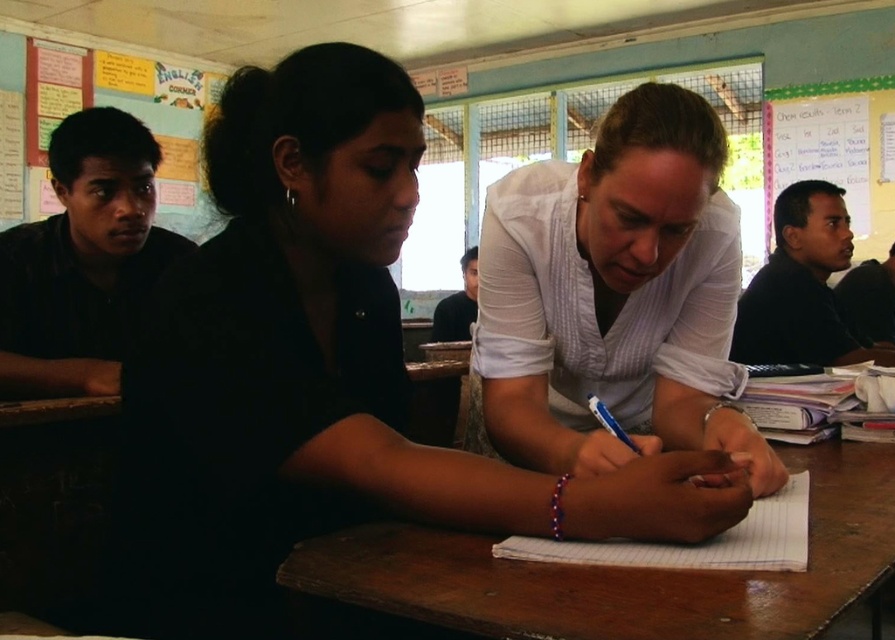
Question: Which point appears closest to the camera in this image?

Choices:
 (A) (827, 481)
 (B) (410, 211)
 (C) (806, 500)

Answer: (B)

Question: Is wooden table at center positioned before white paper at center?

Choices:
 (A) yes
 (B) no

Answer: (A)

Question: Can you confirm if wooden table at center is thinner than white paper at center?

Choices:
 (A) yes
 (B) no

Answer: (B)

Question: Estimate the real-world distances between objects in this image. Which object is farther from the white striped shirt at center?

Choices:
 (A) multicolored paper notices at upper left
 (B) white paper at center
 (C) white matte shirt at center

Answer: (A)

Question: Is wooden table at center above multicolored paper notices at upper left?

Choices:
 (A) yes
 (B) no

Answer: (B)

Question: Which point is closer to the camera?

Choices:
 (A) white matte shirt at center
 (B) white striped shirt at center

Answer: (A)